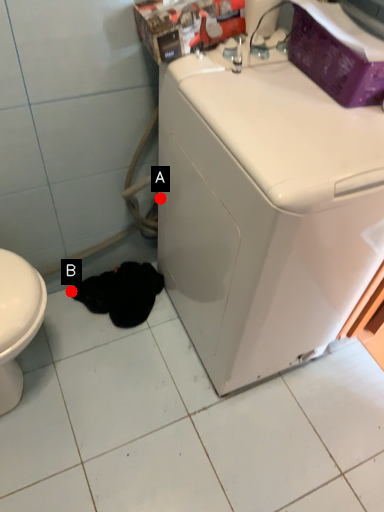
Question: Two points are circled on the image, labeled by A and B beside each circle. Among these points, which one is farthest from the camera?

Choices:
 (A) A is further
 (B) B is further

Answer: (B)